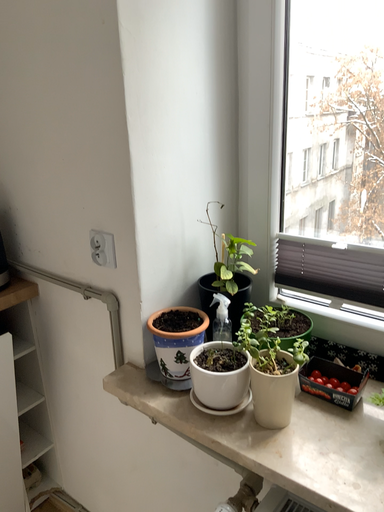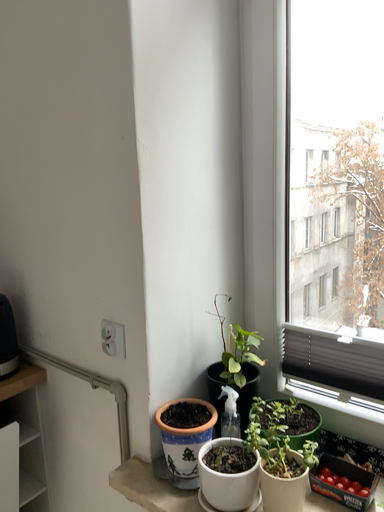
Question: How did the camera likely rotate when shooting the video?

Choices:
 (A) rotated downward
 (B) rotated upward

Answer: (B)